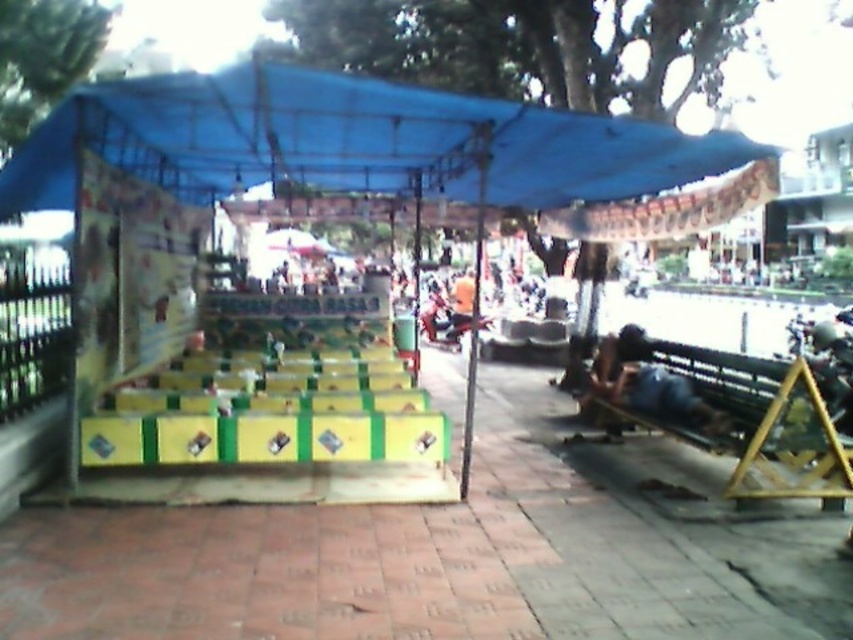
Question: Is blue tarpaulin canopy at upper center further to the viewer compared to dark blue fabric at lower right?

Choices:
 (A) yes
 (B) no

Answer: (B)

Question: Which point is closer to the camera taking this photo?

Choices:
 (A) (665, 371)
 (B) (122, 166)
 (C) (808, 392)
 (D) (143, 138)

Answer: (C)

Question: Can you confirm if green painted concrete pavement at center is positioned to the left of wooden park bench at lower right?

Choices:
 (A) yes
 (B) no

Answer: (A)

Question: Which object is the closest to the wooden park bench at lower right?

Choices:
 (A) green painted concrete pavement at center
 (B) blue fabric tent at center
 (C) dark blue fabric at lower right
 (D) blue tarpaulin canopy at upper center

Answer: (C)

Question: Which point is farther from the camera taking this photo?

Choices:
 (A) (646, 364)
 (B) (659, 422)
 (C) (784, 544)

Answer: (A)

Question: Can you confirm if blue fabric tent at center is wider than wooden park bench at lower right?

Choices:
 (A) yes
 (B) no

Answer: (A)